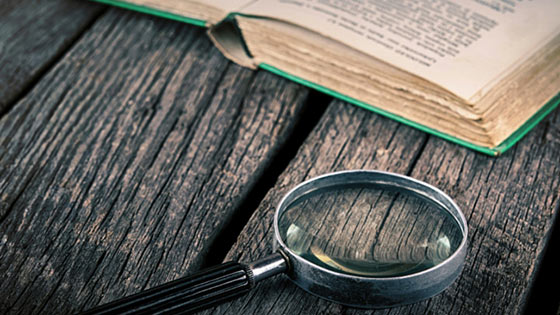
Identify the location of grey wooden boards. The image size is (560, 315). (419, 151), (200, 132), (29, 17).